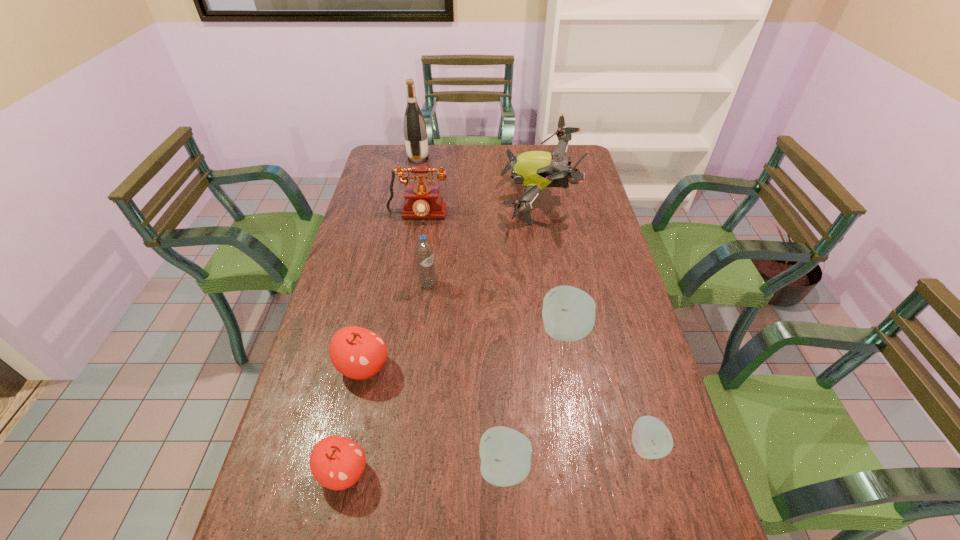
The image size is (960, 540). Find the location of `the third apple from left to right`. the third apple from left to right is located at coordinates (505, 453).

Where is `the second biggest white apple`? the second biggest white apple is located at coordinates (505, 453).

Where is `the smaller red apple`? the smaller red apple is located at coordinates tap(336, 462).

Image resolution: width=960 pixels, height=540 pixels. I want to click on the shortest object, so (651, 439).

Locate an element on the screen. This screenshot has height=540, width=960. the rightmost apple is located at coordinates (651, 439).

You are a GUI agent. You are given a task and a screenshot of the screen. Output one action in this format:
    pyautogui.click(x=<x>, y=<y>)
    Task: Click on the blank space located on the label of the farthest object
    
    Given the screenshot: What is the action you would take?
    pyautogui.click(x=472, y=159)

This screenshot has height=540, width=960. In order to click on vacant space situated 0.150m on the front-facing side of the drone in this screenshot , I will do click(462, 200).

The width and height of the screenshot is (960, 540). What are the coordinates of `vacant space located on the front-facing side of the drone` in the screenshot? It's located at (418, 200).

You are a GUI agent. You are given a task and a screenshot of the screen. Output one action in this format:
    pyautogui.click(x=<x>, y=<y>)
    Task: Click on the blank space located 0.100m on the front-facing side of the drone
    
    Given the screenshot: What is the action you would take?
    pyautogui.click(x=474, y=200)

Find the location of `free region located 0.240m on the dial of the telephone`. free region located 0.240m on the dial of the telephone is located at coordinates (408, 271).